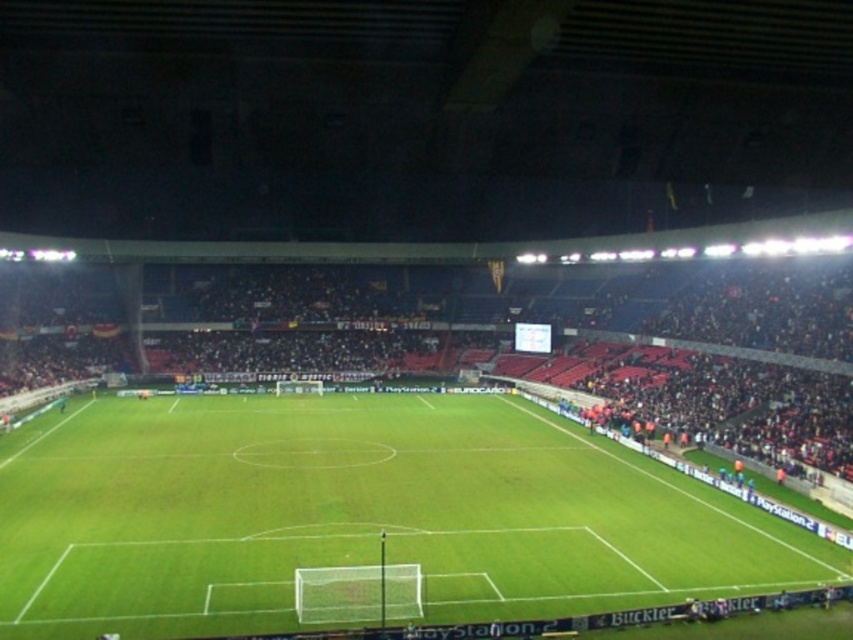
You are a drone operator trying to capture a panoramic shot of the soccer stadium. You need to ensure that both the green grass football field at center and the dark red seats at center are fully visible in the frame. Given their spatial relationship, which object should you prioritize positioning closer to the center of your camera frame to ensure both are captured adequately?

The green grass football field at center has a lesser width compared to dark red seats at center, so you should prioritize positioning the green grass football field at center closer to the center of your camera frame to ensure both are captured adequately.

You are a photographer standing at the edge of the soccer field. You want to take a photo of a specific point in the stadium located at coordinates point [386,412]. Your camera has a maximum focus range of 60 meters. Will your camera be able to focus on that point?

The distance between you and point [386,412] is 66.78 meters, which exceeds the camera maximum focus range of 60 meters. Therefore, the camera cannot focus on that point.